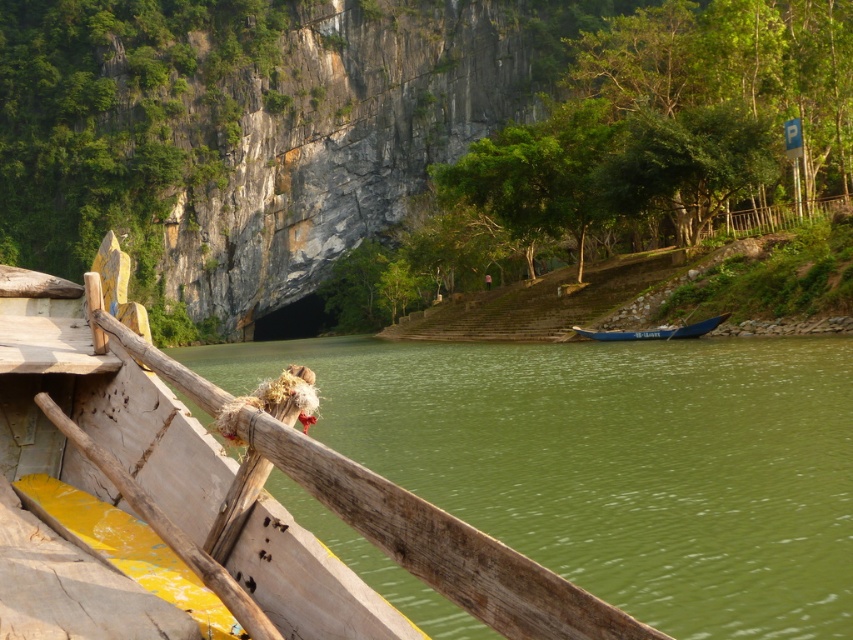
Does green smooth water at lower left appear on the left side of blue polished wood boat at center?

Correct, you'll find green smooth water at lower left to the left of blue polished wood boat at center.

Describe the element at coordinates (613, 461) in the screenshot. I see `green smooth water at lower left` at that location.

Does point (553, 508) lie behind point (682, 337)?

No.

The width and height of the screenshot is (853, 640). I want to click on green smooth water at lower left, so click(613, 461).